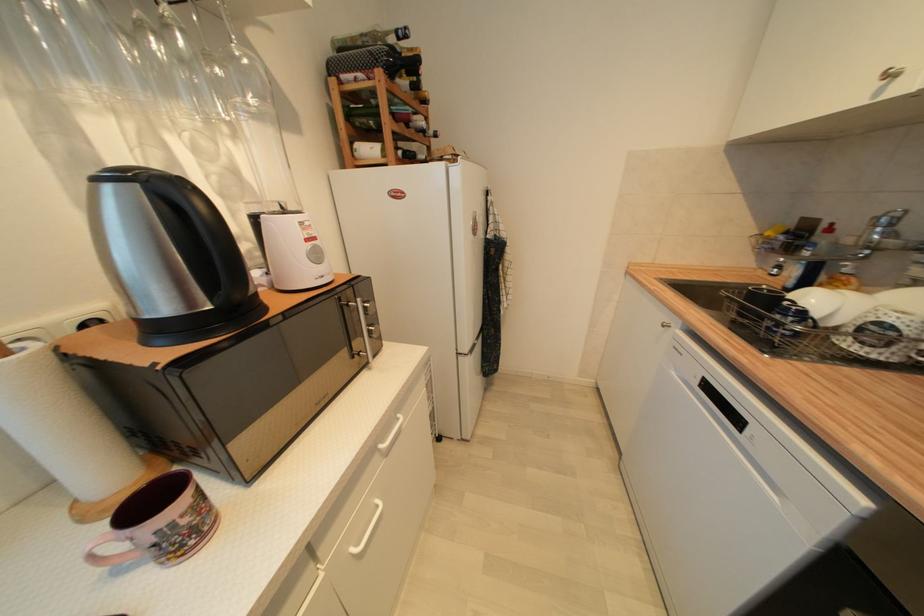
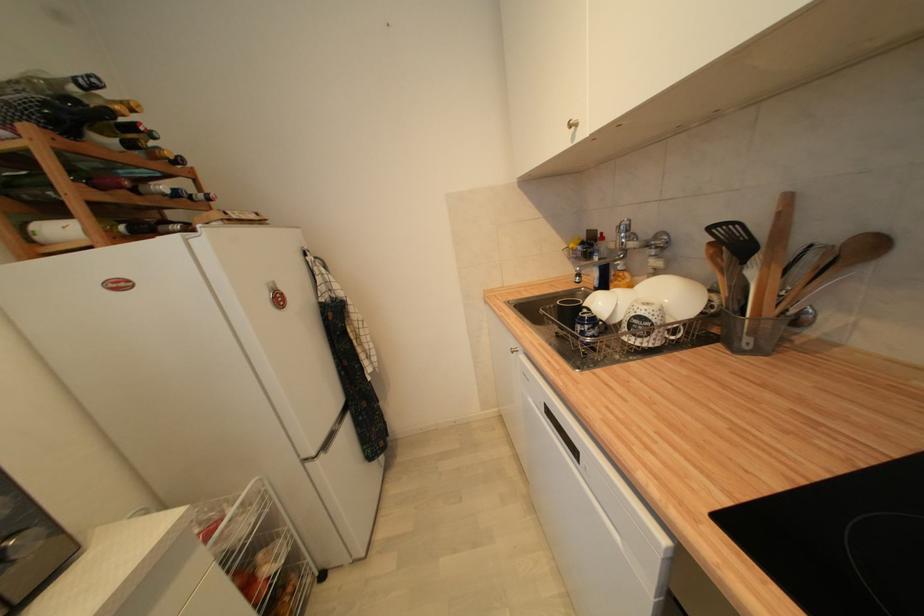
In the second image, find the point that corresponds to point 792,317 in the first image.

(588, 326)